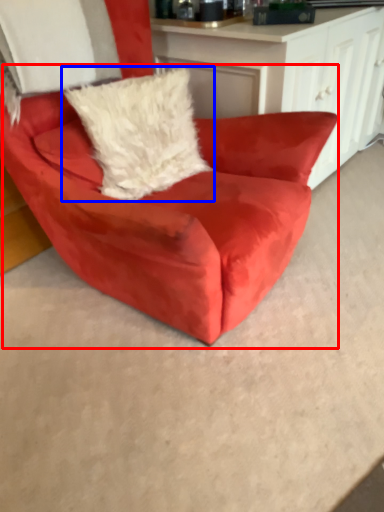
Question: Which object is closer to the camera taking this photo, chair (highlighted by a red box) or pillow (highlighted by a blue box)?

Choices:
 (A) chair
 (B) pillow

Answer: (A)